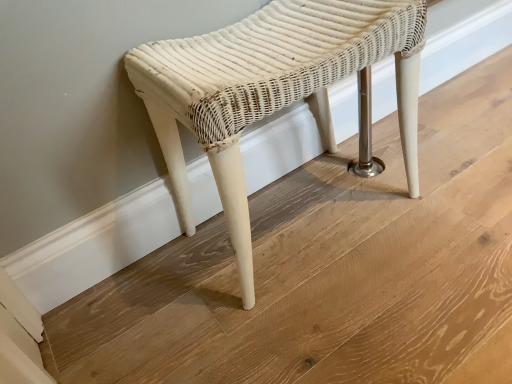
This screenshot has width=512, height=384. Find the location of `blank space to the left of white wicker stool at center`. blank space to the left of white wicker stool at center is located at coordinates (152, 298).